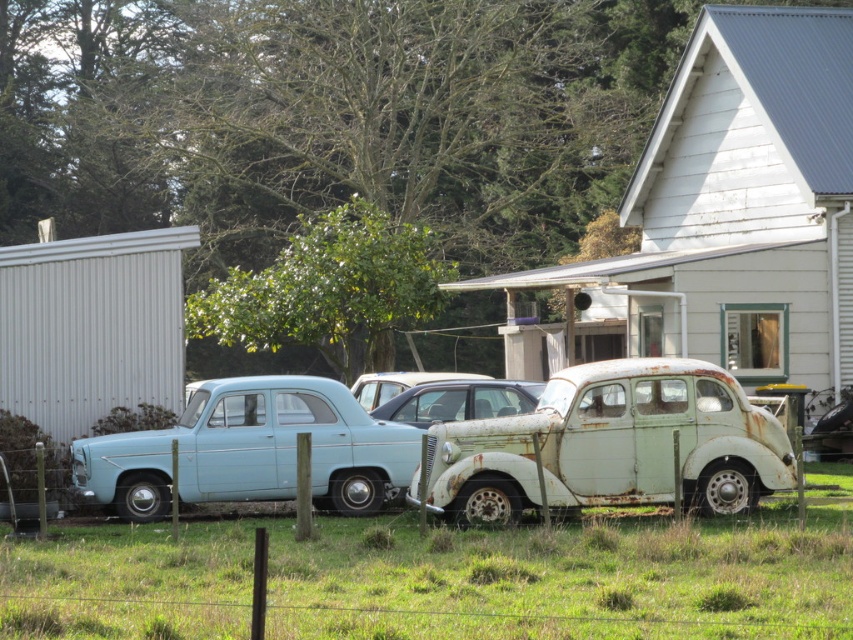
Question: Is rusty metal pickup truck at center bigger than light blue matte sedan at center?

Choices:
 (A) no
 (B) yes

Answer: (B)

Question: Which of the following is the closest to the observer?

Choices:
 (A) (659, 493)
 (B) (381, 403)

Answer: (A)

Question: Can you confirm if green grass at lower center is thinner than rusty metal pickup truck at center?

Choices:
 (A) yes
 (B) no

Answer: (B)

Question: Among these objects, which one is nearest to the camera?

Choices:
 (A) rusty metal pickup truck at center
 (B) light blue matte sedan at center
 (C) rusty metal car at center

Answer: (A)

Question: Is rusty metal pickup truck at center to the left of light blue matte sedan at center from the viewer's perspective?

Choices:
 (A) yes
 (B) no

Answer: (B)

Question: Which is farther from the light blue matte sedan at center?

Choices:
 (A) green grass at lower center
 (B) rusty metal pickup truck at center
 (C) rusty metal car at center

Answer: (C)